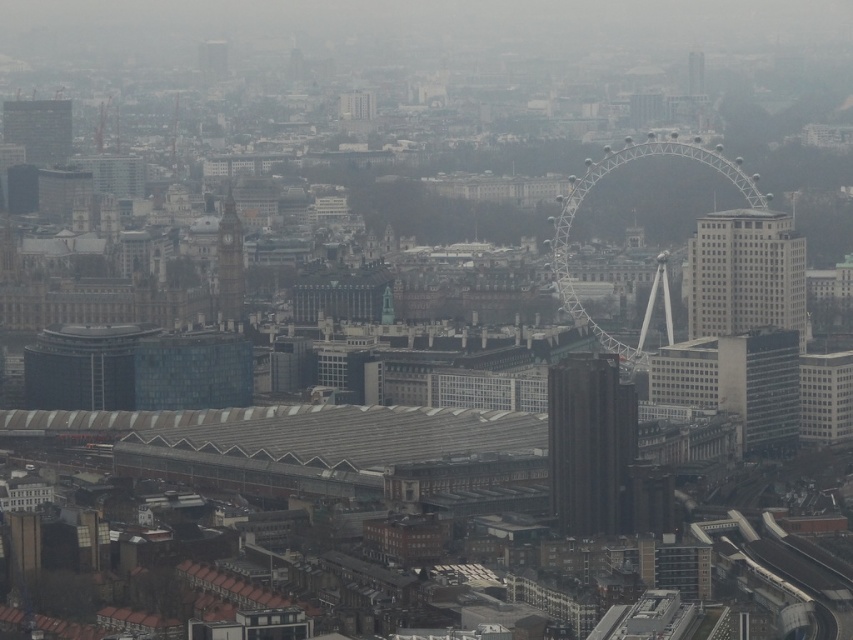
Question: In this image, where is white glass building at center-right located relative to matte glass skyscraper at upper left?

Choices:
 (A) left
 (B) right

Answer: (B)

Question: Estimate the real-world distances between objects in this image. Which object is closer to the white glass building at center-right?

Choices:
 (A) dark gray stone clock tower at center-left
 (B) smooth black tower at center

Answer: (B)

Question: Is white glass building at center-right thinner than smooth glass tower at upper right?

Choices:
 (A) yes
 (B) no

Answer: (B)

Question: Which of the following is the closest to the observer?

Choices:
 (A) (554, 422)
 (B) (41, 118)
 (C) (699, 83)

Answer: (A)

Question: Among these objects, which one is farthest from the camera?

Choices:
 (A) smooth glass tower at upper right
 (B) smooth black tower at center
 (C) dark gray stone clock tower at center-left

Answer: (A)

Question: Is smooth black tower at center bigger than dark gray stone clock tower at center-left?

Choices:
 (A) no
 (B) yes

Answer: (B)